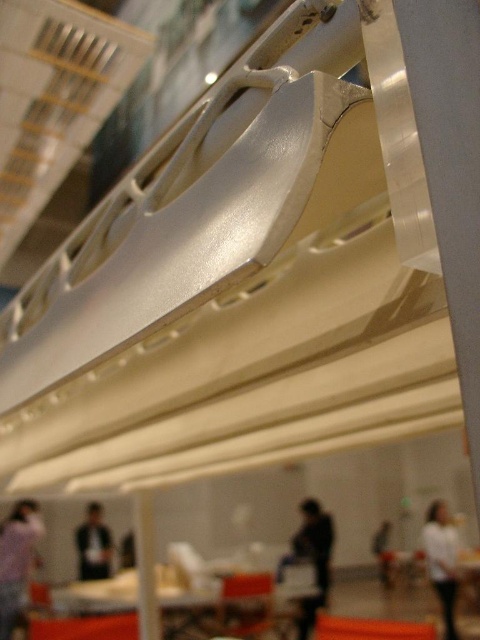
Between dark clothing at center and white matte shirt at lower right, which one is positioned lower?

dark clothing at center is below.

Image resolution: width=480 pixels, height=640 pixels. I want to click on dark clothing at center, so click(312, 557).

Is point (299, 560) in front of point (450, 600)?

No, it is behind (450, 600).

The image size is (480, 640). I want to click on dark clothing at center, so click(312, 557).

Is point (19, 564) positioned behind point (445, 528)?

Yes, point (19, 564) is behind point (445, 528).

Is light purple shirt at lower left to the right of white matte shirt at lower right from the viewer's perspective?

In fact, light purple shirt at lower left is to the left of white matte shirt at lower right.

Between point (16, 611) and point (443, 532), which one is positioned behind?

Point (443, 532)

This screenshot has width=480, height=640. Find the location of `light purple shirt at lower left`. light purple shirt at lower left is located at coordinates (16, 561).

Is light purple shirt at lower left further to camera compared to dark clothing at center?

No, it is in front of dark clothing at center.

Is point (3, 582) farther from viewer compared to point (319, 531)?

No.

Find the location of a particular element. light purple shirt at lower left is located at coordinates (16, 561).